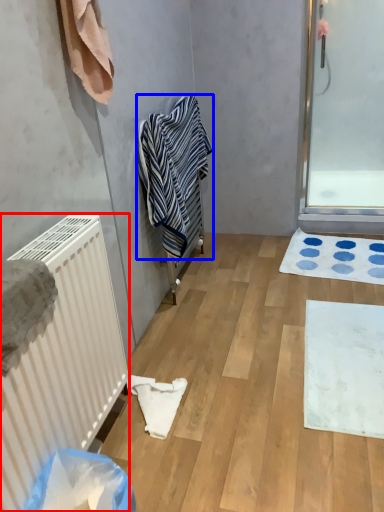
Question: Among these objects, which one is farthest to the camera, radiator (highlighted by a red box) or towel (highlighted by a blue box)?

Choices:
 (A) radiator
 (B) towel

Answer: (B)